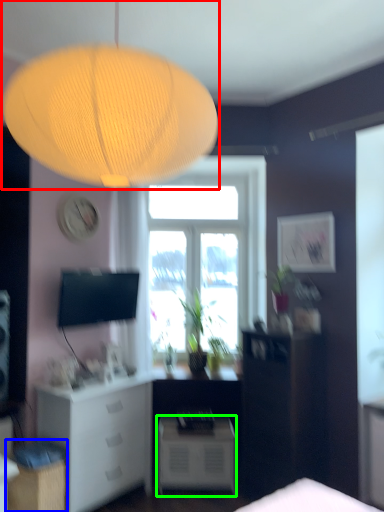
Question: Which object is the closest to the lamp (highlighted by a red box)? Choose among these: cabinetry (highlighted by a blue box) or nightstand (highlighted by a green box).

Choices:
 (A) cabinetry
 (B) nightstand

Answer: (A)